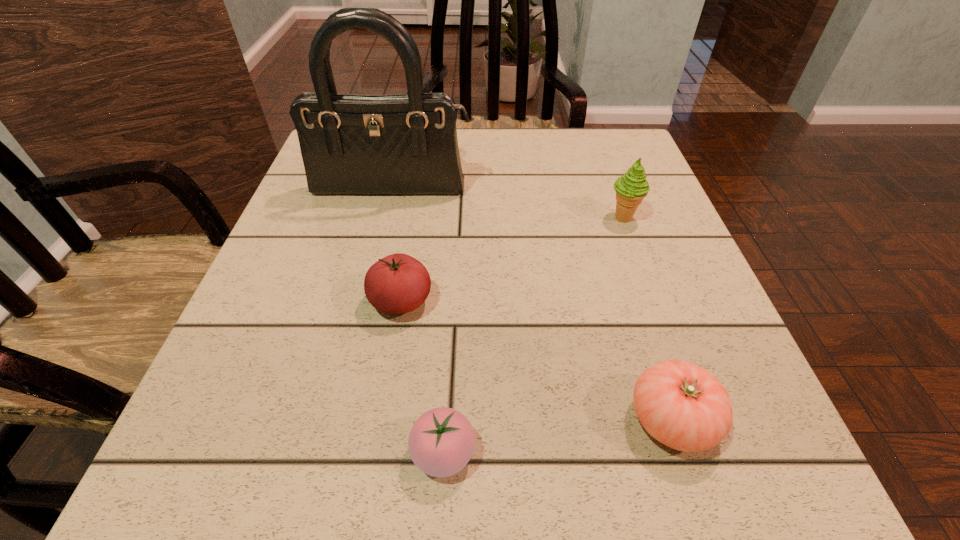
I want to click on vacant space at the near left corner of the desktop, so click(x=267, y=437).

Where is `free spot between the rightmost tomato and the second farthest object`? Image resolution: width=960 pixels, height=540 pixels. free spot between the rightmost tomato and the second farthest object is located at coordinates (647, 319).

Find the location of a particular element. The width and height of the screenshot is (960, 540). free space between the tallest object and the third farthest object is located at coordinates (396, 246).

Where is `free space that is in between the farthest tomato and the icecream`? free space that is in between the farthest tomato and the icecream is located at coordinates (512, 259).

I want to click on vacant space that is in between the fourth shortest object and the handbag, so click(x=507, y=204).

The width and height of the screenshot is (960, 540). I want to click on free space between the shortest tomato and the icecream, so click(x=533, y=335).

The height and width of the screenshot is (540, 960). I want to click on empty space between the rightmost tomato and the icecream, so click(647, 319).

Identify the location of vacant area that lies between the rightmost tomato and the second tallest object. Image resolution: width=960 pixels, height=540 pixels. (647, 319).

Locate an element on the screen. This screenshot has width=960, height=540. vacant area between the shortest tomato and the farthest object is located at coordinates (418, 322).

Locate an element on the screen. The image size is (960, 540). free spot between the rightmost tomato and the icecream is located at coordinates (647, 319).